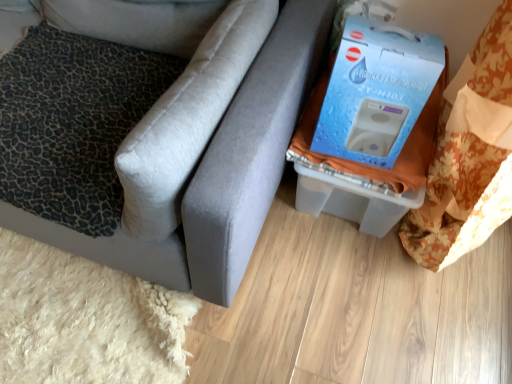
Question: Is matte gray couch at lower right positioned with its back to leopard print fabric pillow at left, acting as the 1th pillow starting from the bottom?

Choices:
 (A) yes
 (B) no

Answer: (A)

Question: Is matte gray couch at lower right behind leopard print fabric pillow at left, acting as the 1th pillow starting from the bottom?

Choices:
 (A) no
 (B) yes

Answer: (A)

Question: Can you confirm if matte gray couch at lower right is shorter than leopard print fabric pillow at left, which ranks as the second pillow in top-to-bottom order?

Choices:
 (A) yes
 (B) no

Answer: (B)

Question: Is matte gray couch at lower right not near leopard print fabric pillow at left, acting as the 1th pillow starting from the bottom?

Choices:
 (A) no
 (B) yes

Answer: (A)

Question: Considering the relative sizes of matte gray couch at lower right and leopard print fabric pillow at left, acting as the 1th pillow starting from the bottom, in the image provided, is matte gray couch at lower right wider than leopard print fabric pillow at left, acting as the 1th pillow starting from the bottom,?

Choices:
 (A) no
 (B) yes

Answer: (B)

Question: From the image's perspective, is matte gray couch at lower right under leopard print fabric pillow at left, which ranks as the second pillow in top-to-bottom order?

Choices:
 (A) no
 (B) yes

Answer: (A)

Question: From the image's perspective, is leopard print cushion at left, positioned as the first pillow in top-to-bottom order, located beneath matte gray couch at lower right?

Choices:
 (A) no
 (B) yes

Answer: (A)

Question: Would you say leopard print cushion at left, positioned as the second pillow in bottom-to-top order, contains matte gray couch at lower right?

Choices:
 (A) no
 (B) yes

Answer: (A)

Question: Are leopard print cushion at left, positioned as the second pillow in bottom-to-top order, and matte gray couch at lower right making contact?

Choices:
 (A) yes
 (B) no

Answer: (B)

Question: Could you tell me if leopard print cushion at left, positioned as the second pillow in bottom-to-top order, is facing matte gray couch at lower right?

Choices:
 (A) no
 (B) yes

Answer: (B)

Question: Considering the relative positions of leopard print cushion at left, positioned as the first pillow in top-to-bottom order, and matte gray couch at lower right in the image provided, is leopard print cushion at left, positioned as the first pillow in top-to-bottom order, behind matte gray couch at lower right?

Choices:
 (A) yes
 (B) no

Answer: (A)

Question: Considering the relative sizes of leopard print cushion at left, positioned as the second pillow in bottom-to-top order, and matte gray couch at lower right in the image provided, is leopard print cushion at left, positioned as the second pillow in bottom-to-top order, smaller than matte gray couch at lower right?

Choices:
 (A) no
 (B) yes

Answer: (B)

Question: Is leopard print fabric pillow at left, which ranks as the second pillow in top-to-bottom order, aimed at matte gray couch at lower right?

Choices:
 (A) no
 (B) yes

Answer: (B)